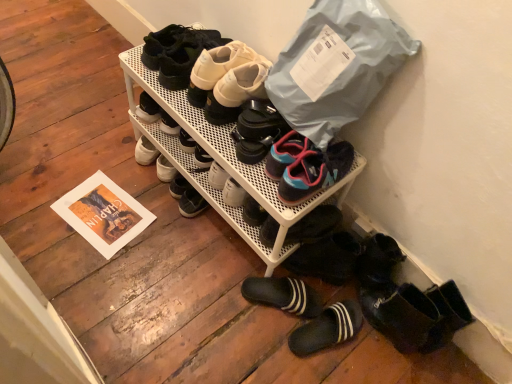
What are the coordinates of `vacant region under black rubber slippers at lower center, the 1th footwear in the bottom-to-top sequence (from a real-world perspective)` in the screenshot? It's located at (315, 325).